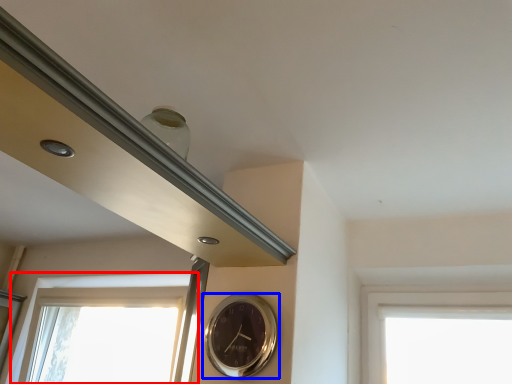
Question: Which object is closer to the camera taking this photo, window (highlighted by a red box) or wall clock (highlighted by a blue box)?

Choices:
 (A) window
 (B) wall clock

Answer: (B)